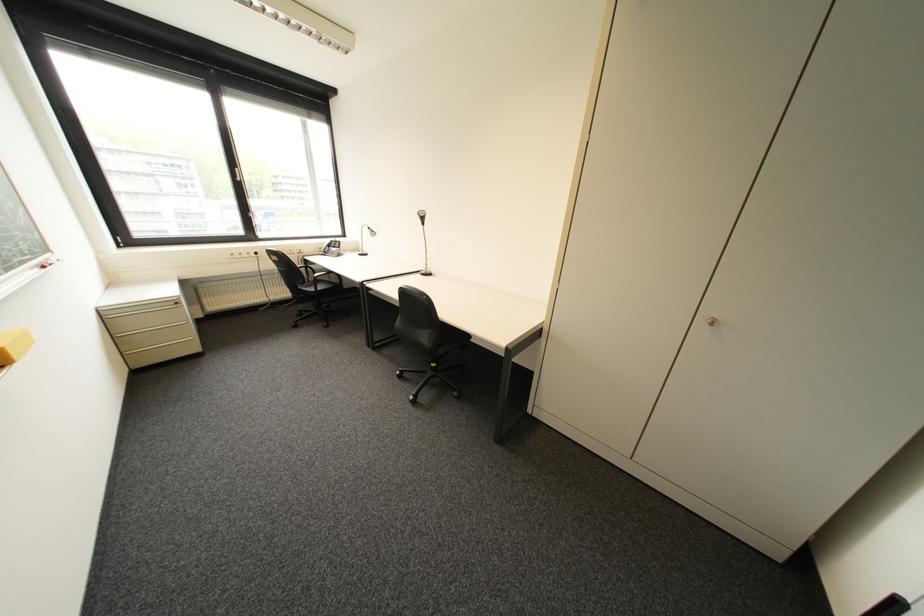
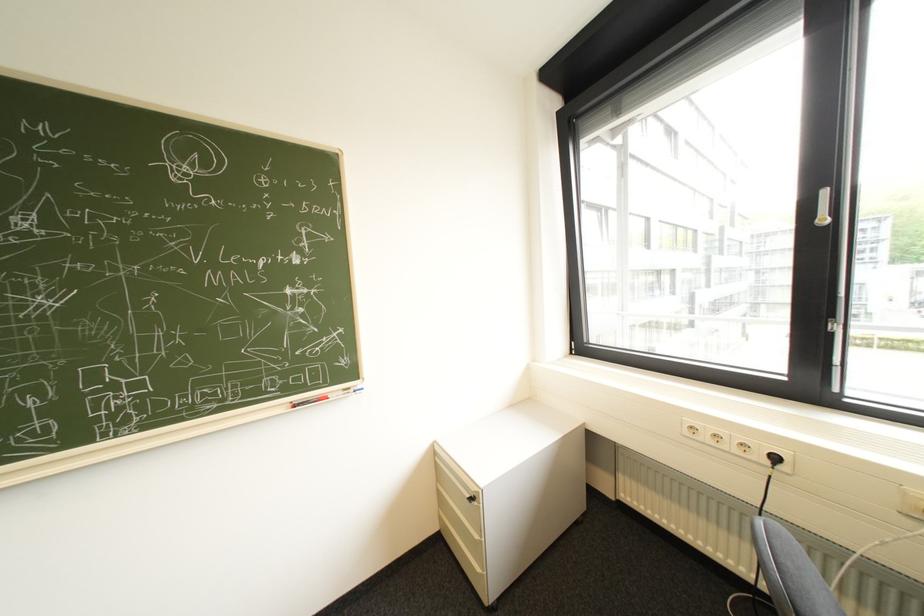
The point at (x=241, y=257) is marked in the first image. Where is the corresponding point in the second image?

(698, 434)